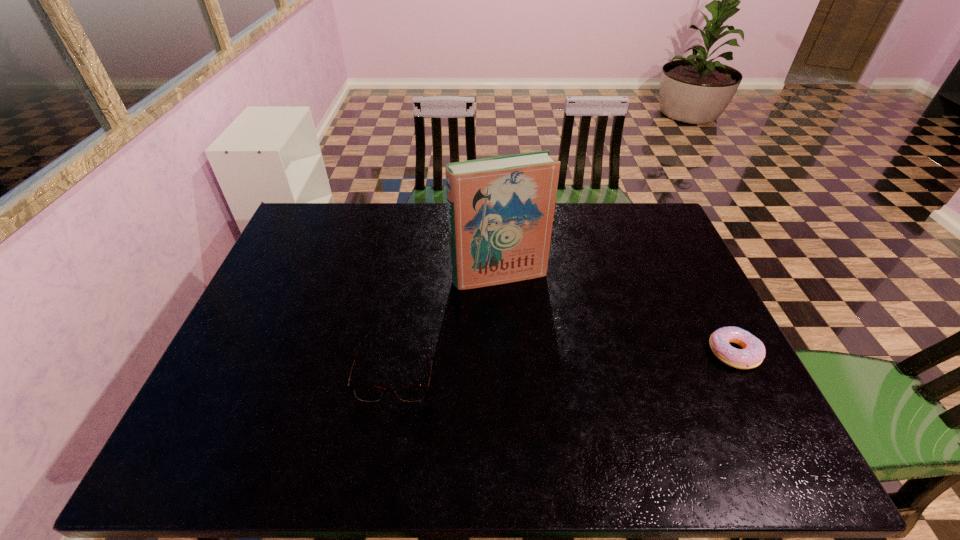
Find the location of a particular element. This screenshot has height=540, width=960. free spot on the desktop that is between the leftmost object and the doughnut and is positioned on the cover of the farthest object is located at coordinates (535, 361).